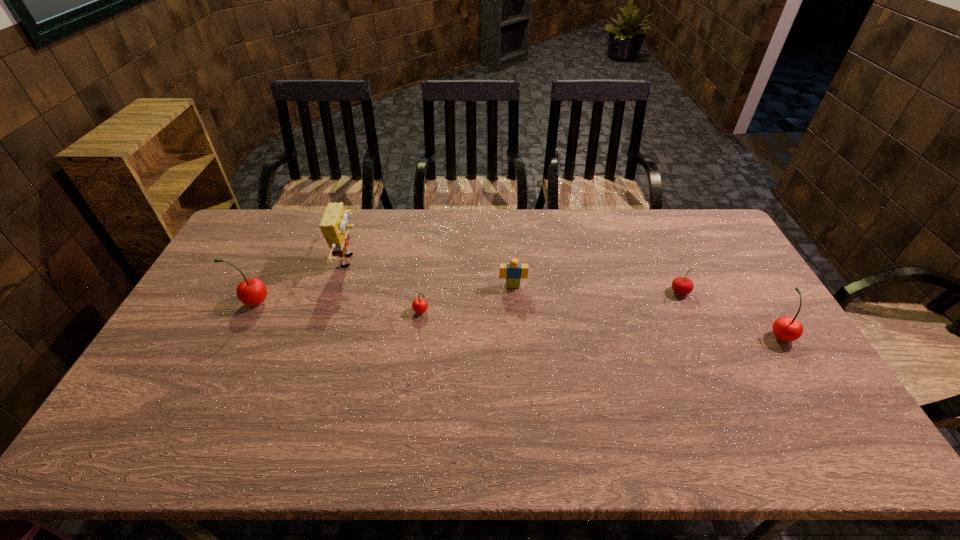
To make them evenly spaced by inserting another cherry among them, please locate a vacant spot for this new cherry. Please provide its 2D coordinates. Your answer should be formatted as a tuple, i.e. [(x, y)], where the tuple contains the x and y coordinates of a point satisfying the conditions above.

[(596, 323)]